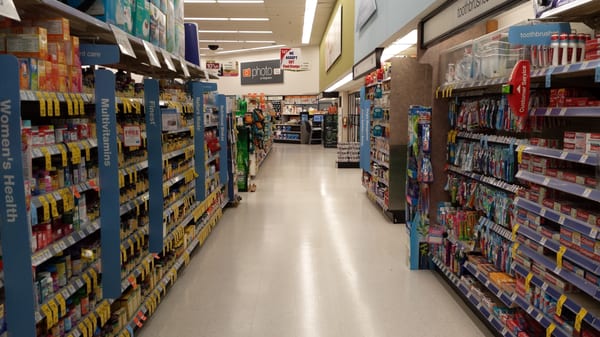
Where is `shelves`? This screenshot has width=600, height=337. shelves is located at coordinates (120, 100), (74, 143), (81, 184), (90, 229), (142, 199).